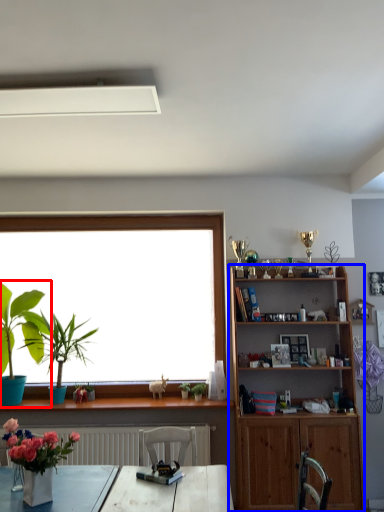
Question: Which point is further to the camera, houseplant (highlighted by a red box) or shelf (highlighted by a blue box)?

Choices:
 (A) houseplant
 (B) shelf

Answer: (A)